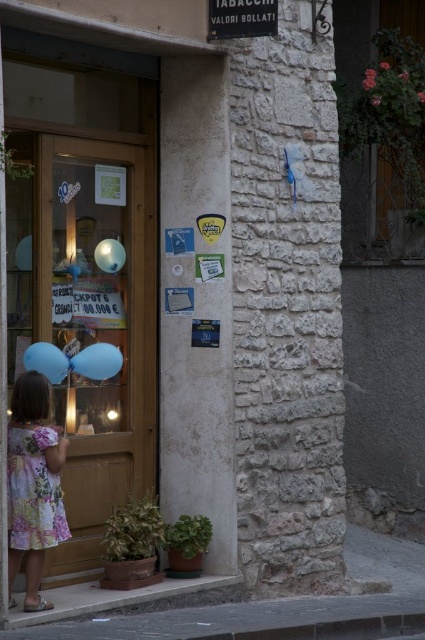
You are a delivery person trying to hang a new sign on the wall between the black metal sign at upper center and the light blue balloon at left. The new sign requires 30 cm of space. Can you fit it there?

The black metal sign at upper center is larger in size than the light blue balloon at left, but the exact distance between them isn not specified. Without knowing the actual space available, it is uncertain if the new sign requiring 30 cm can fit there.

You are a delivery person trying to hang a new sign above the black metal sign at upper center. However, there is a blue matte balloon at left in the way. Can you place the new sign above the existing one without moving the balloon?

The black metal sign at upper center is positioned over the blue matte balloon at left, so there is already space above the balloon for the new sign. However, since the existing black metal sign is already above the balloon, placing another sign above it might require additional vertical space that may not be available. You should check the available space above the existing sign before proceeding.